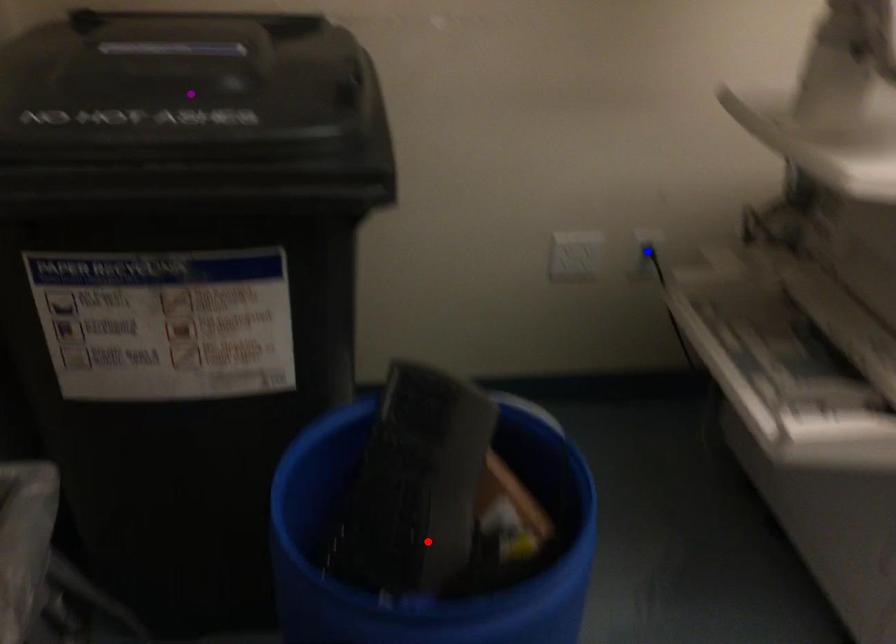
From the picture: Order these from nearest to farthest:
purple point | red point | blue point

1. purple point
2. red point
3. blue point